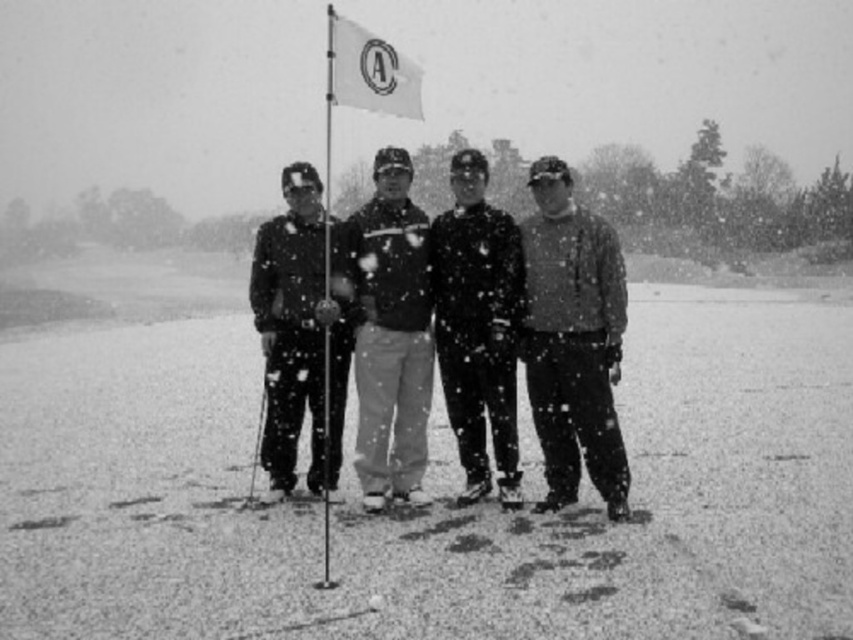
Question: Which object is the closest to the dark gray cotton pants at center?

Choices:
 (A) white fabric flag at center
 (B) matte black jacket at center
 (C) metallic ski pole at center
 (D) matte gray sweater at right

Answer: (B)

Question: Among these objects, which one is farthest from the camera?

Choices:
 (A) matte gray sweater at right
 (B) metallic ski pole at center

Answer: (B)

Question: Does smooth asphalt at center have a smaller size compared to matte black jacket at center?

Choices:
 (A) no
 (B) yes

Answer: (A)

Question: Does smooth asphalt at center appear on the right side of white fabric flag at center?

Choices:
 (A) yes
 (B) no

Answer: (A)

Question: Does matte gray sweater at right appear on the right side of metallic ski pole at center?

Choices:
 (A) yes
 (B) no

Answer: (A)

Question: Which object is farther from the camera taking this photo?

Choices:
 (A) smooth asphalt at center
 (B) matte gray sweater at right
 (C) dark gray cotton pants at center
 (D) metallic ski pole at center

Answer: (D)